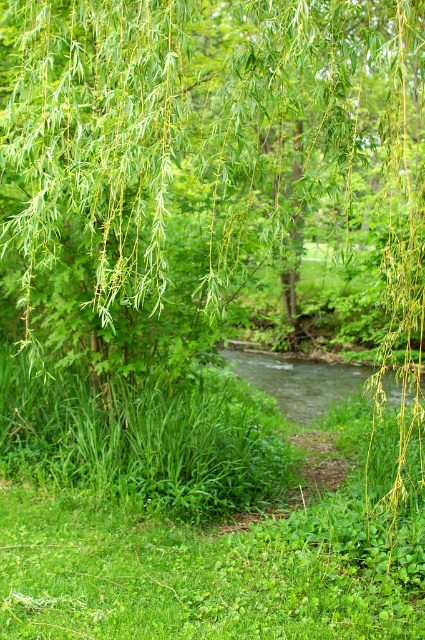
Which is more to the left, green leafy willow at upper center or green grassy creek at center?

Positioned to the left is green leafy willow at upper center.

What do you see at coordinates (209, 157) in the screenshot? This screenshot has width=425, height=640. I see `green leafy willow at upper center` at bounding box center [209, 157].

The height and width of the screenshot is (640, 425). I want to click on green leafy willow at upper center, so click(x=209, y=157).

Does green leafy grass at center appear on the left side of green grassy creek at center?

Yes, green leafy grass at center is to the left of green grassy creek at center.

Describe the element at coordinates (187, 518) in the screenshot. I see `green leafy grass at center` at that location.

This screenshot has height=640, width=425. Find the location of `green leafy grass at center`. green leafy grass at center is located at coordinates (187, 518).

Who is more distant from viewer, [379,17] or [48,525]?

The point [379,17] is behind.

The image size is (425, 640). What are the coordinates of `green leafy willow at upper center` in the screenshot? It's located at (209, 157).